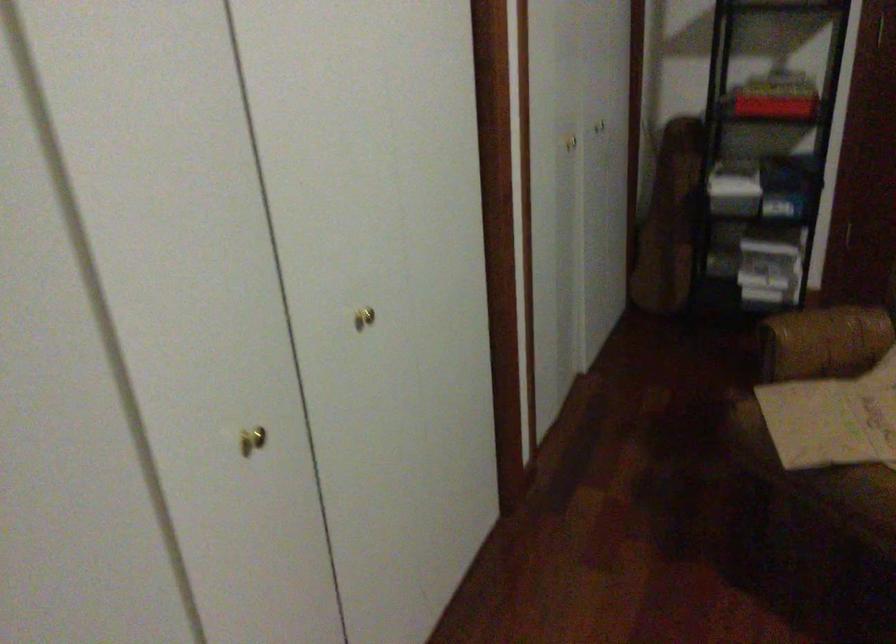
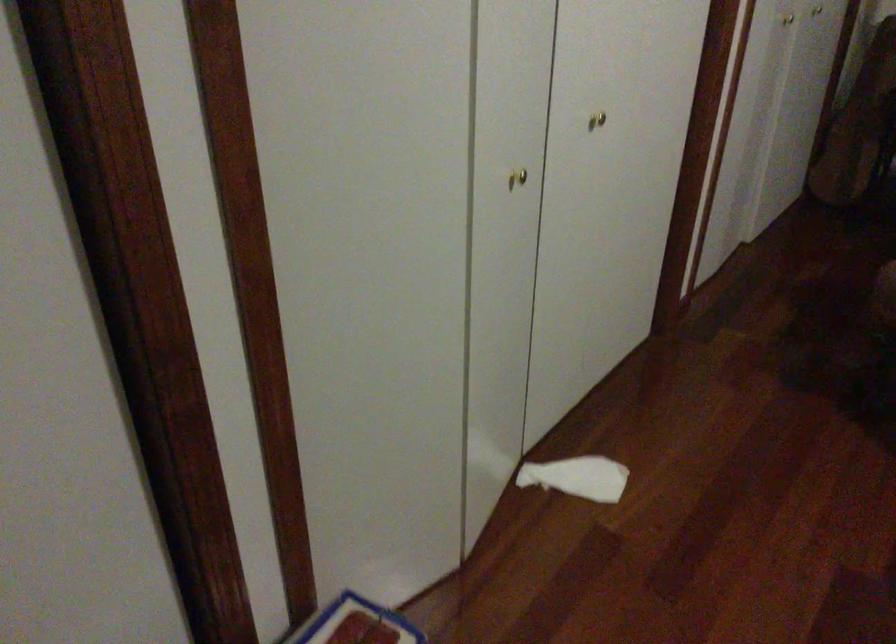
Locate, in the second image, the point that corresponds to [368,327] in the first image.

(597, 120)